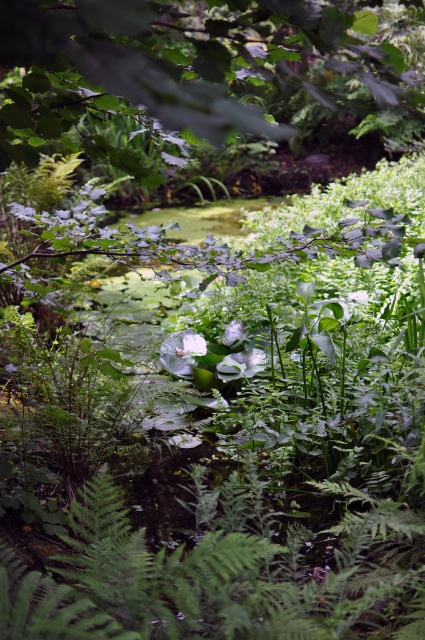
You are standing in a garden and want to take a photo of the point at coordinates [283,38]. Your camera has a focal length of 50mm and you are 2 meters away from the subject. Is the point within the camera frame?

The point at coordinates [283,38] is 1.65 meters from the camera. Since you are 2 meters away from the subject, the point is within the camera frame.

Based on the photo, you are standing in a garden and want to take a photo of the green leafy tree at upper center. If your camera can focus on objects up to 30 inches away, will you need to move closer or farther away to capture a clear photo?

The green leafy tree at upper center is 33.36 inches away from you. Since your camera can focus up to 30 inches, you need to move closer to ensure it is within the camera range.

You are a bird flying over the garden scene. You see the green leafy tree at upper center and the white matte flower at center. Which object is higher in the scene?

The green leafy tree at upper center is higher than the white matte flower at center because it is positioned above it.